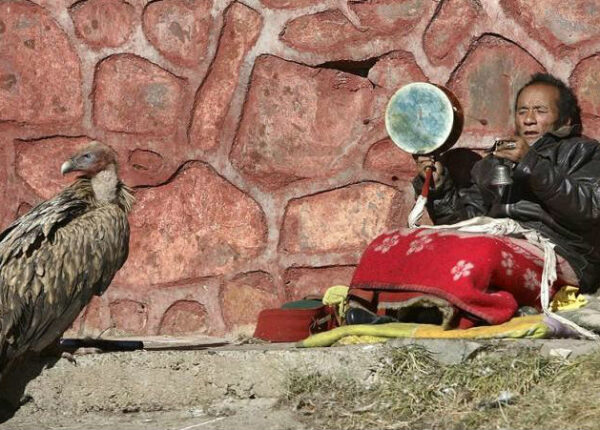
Locate an element on the screen. The image size is (600, 430). yellow blanket is located at coordinates (424, 328), (500, 335), (526, 326).